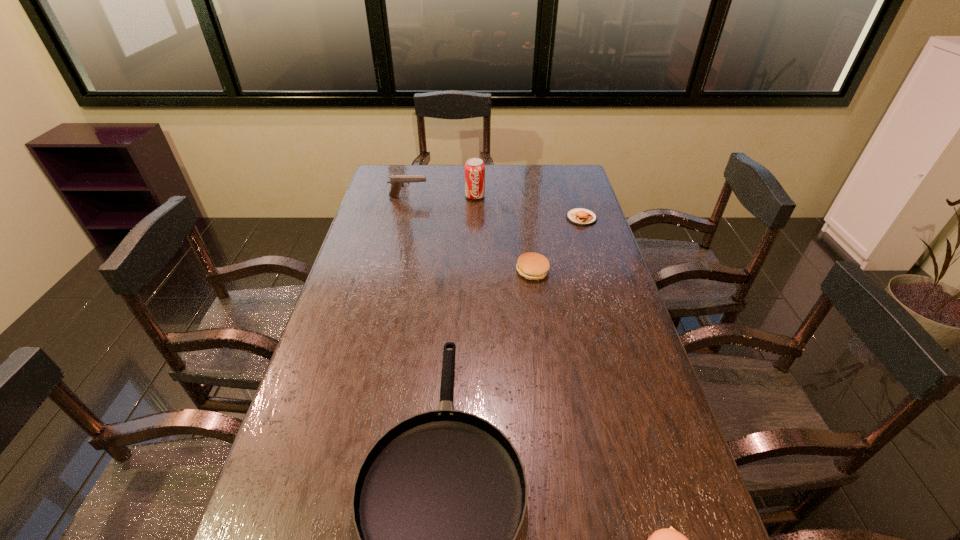
Locate an element on the screen. The height and width of the screenshot is (540, 960). object that is at the left edge is located at coordinates (397, 181).

At what (x,y) coordinates should I click in order to perform the action: click on object located in the right edge section of the desktop. Please return your answer as a coordinate pair (x, y). Looking at the image, I should click on (579, 216).

This screenshot has height=540, width=960. I want to click on free region at the far edge of the desktop, so click(534, 187).

Where is `free region at the left edge of the desktop`? The height and width of the screenshot is (540, 960). free region at the left edge of the desktop is located at coordinates (374, 255).

In the image, there is a desktop. Where is `vacant space at the right edge`? This screenshot has height=540, width=960. vacant space at the right edge is located at coordinates (602, 236).

Where is `free space between the soda can and the second tallest object`? free space between the soda can and the second tallest object is located at coordinates (442, 197).

This screenshot has width=960, height=540. Identify the location of free space between the third nearest object and the farthest patty. (557, 245).

You are a GUI agent. You are given a task and a screenshot of the screen. Output one action in this format:
    pyautogui.click(x=<x>, y=<y>)
    Task: Click on the free spot between the soda can and the farthest patty
    The image size is (960, 540).
    Given the screenshot: What is the action you would take?
    pyautogui.click(x=528, y=207)

Identify the location of free space between the second tallest object and the farthest patty. (495, 207).

This screenshot has width=960, height=540. I want to click on the fifth closest object to the tallest object, so click(x=665, y=539).